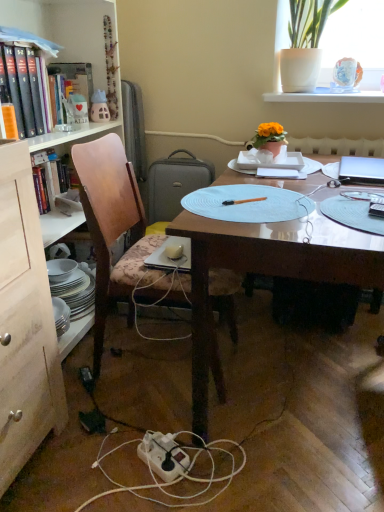
You are a GUI agent. You are given a task and a screenshot of the screen. Output one action in this format:
    pyautogui.click(x=<x>, y=<y>)
    Task: Click on the free spot behind white plastic power outlet at lower center
    
    Given the screenshot: What is the action you would take?
    pyautogui.click(x=156, y=414)